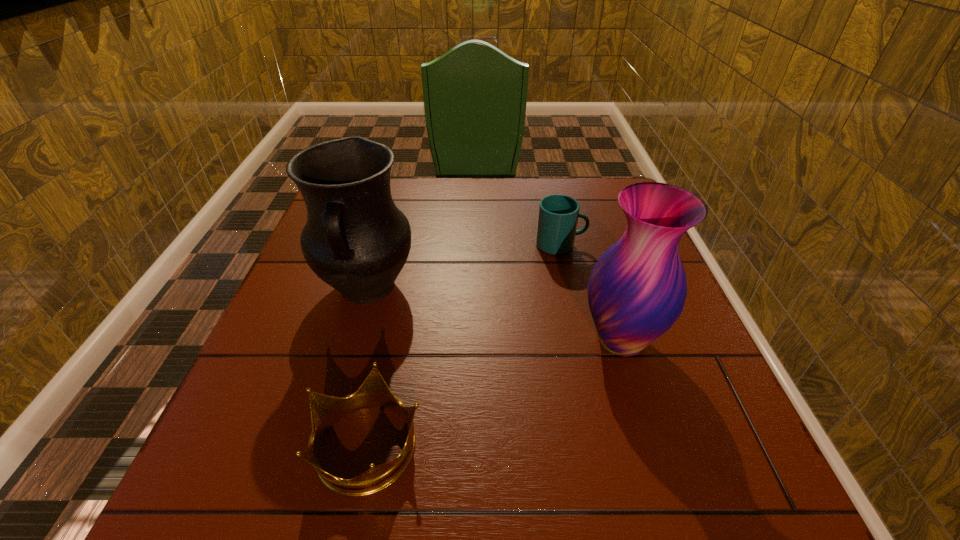
The image size is (960, 540). Identify the location of vacant space that satisfies the following two spatial constraints: 1. on the handle side of the cup; 2. on the left side of the vase. (583, 340).

Locate an element on the screen. This screenshot has width=960, height=540. vacant space that satisfies the following two spatial constraints: 1. on the handle side of the pitcher; 2. on the left side of the vase is located at coordinates (352, 340).

Find the location of a particular element. vacant position in the image that satisfies the following two spatial constraints: 1. on the handle side of the shortest object; 2. on the right side of the pitcher is located at coordinates (323, 444).

Where is `free region that satisfies the following two spatial constraints: 1. on the handle side of the pitcher; 2. on the left side of the vase`? free region that satisfies the following two spatial constraints: 1. on the handle side of the pitcher; 2. on the left side of the vase is located at coordinates (352, 340).

Find the location of a particular element. This screenshot has height=540, width=960. vacant space that satisfies the following two spatial constraints: 1. on the handle side of the cup; 2. on the back side of the vase is located at coordinates (583, 340).

This screenshot has height=540, width=960. What are the coordinates of `free point that satisfies the following two spatial constraints: 1. on the back side of the vase; 2. on the handle side of the cup` in the screenshot? It's located at 590,245.

Locate an element on the screen. The height and width of the screenshot is (540, 960). free space that satisfies the following two spatial constraints: 1. on the handle side of the vase; 2. on the right side of the pitcher is located at coordinates (352, 340).